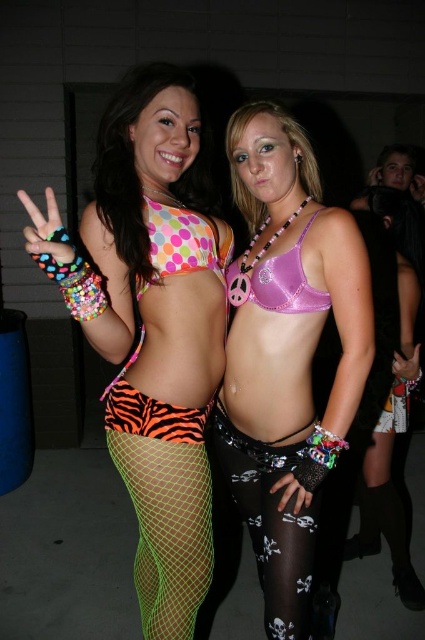
Is pink shiny bra at center positioned behind neon green mesh tights at lower left?

No, it is in front of neon green mesh tights at lower left.

The width and height of the screenshot is (425, 640). In order to click on pink shiny bra at center in this screenshot , I will do `click(286, 353)`.

Image resolution: width=425 pixels, height=640 pixels. What do you see at coordinates (286, 353) in the screenshot? I see `pink shiny bra at center` at bounding box center [286, 353].

You are a GUI agent. You are given a task and a screenshot of the screen. Output one action in this format:
    pyautogui.click(x=<x>, y=<y>)
    Task: Click on the pink shiny bra at center
    
    Given the screenshot: What is the action you would take?
    pyautogui.click(x=286, y=353)

Can you confirm if neon polka dot bikini top at center is positioned to the left of purple satin bikini top at center?

Correct, you'll find neon polka dot bikini top at center to the left of purple satin bikini top at center.

Which is behind, point (206, 540) or point (238, 300)?

The point (238, 300) is behind.

I want to click on neon polka dot bikini top at center, so click(x=152, y=326).

Can you confirm if neon polka dot bikini top at center is positioned to the left of polka dot bikini top at center?

Indeed, neon polka dot bikini top at center is positioned on the left side of polka dot bikini top at center.

Does neon polka dot bikini top at center come behind polka dot bikini top at center?

No, it is in front of polka dot bikini top at center.

The width and height of the screenshot is (425, 640). Find the location of `neon polka dot bikini top at center`. neon polka dot bikini top at center is located at coordinates (152, 326).

Where is `neon polka dot bikini top at center`? Image resolution: width=425 pixels, height=640 pixels. neon polka dot bikini top at center is located at coordinates (152, 326).